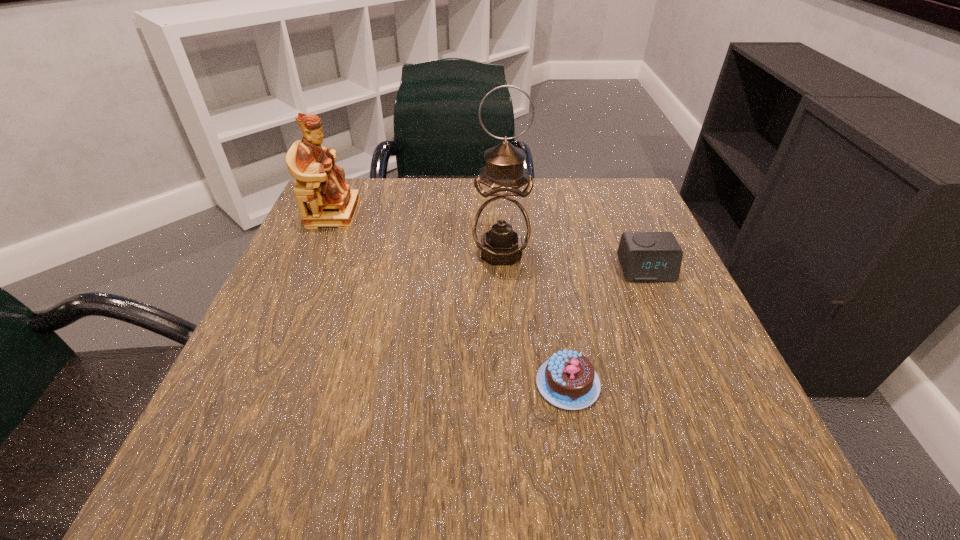
Locate an element on the screen. free space between the oil lamp and the third tallest object is located at coordinates (573, 261).

The width and height of the screenshot is (960, 540). I want to click on object that ranks as the closest to the oil lamp, so click(x=644, y=256).

Select which object appears as the closest to the rightmost object. Please provide its 2D coordinates. Your answer should be formatted as a tuple, i.e. [(x, y)], where the tuple contains the x and y coordinates of a point satisfying the conditions above.

[(501, 229)]

Where is `free space in the image that satisfies the following two spatial constraints: 1. on the front-facing side of the leftmost object; 2. on the back side of the oil lamp`? The width and height of the screenshot is (960, 540). free space in the image that satisfies the following two spatial constraints: 1. on the front-facing side of the leftmost object; 2. on the back side of the oil lamp is located at coordinates (317, 252).

You are a GUI agent. You are given a task and a screenshot of the screen. Output one action in this format:
    pyautogui.click(x=<x>, y=<y>)
    Task: Click on the vacant region that satisfies the following two spatial constraints: 1. on the front-facing side of the leftmost object; 2. on the back side of the nearest object
    
    Given the screenshot: What is the action you would take?
    pyautogui.click(x=258, y=383)

Where is `vacant area in the image that satisfies the following two spatial constraints: 1. on the front-facing side of the farthest object; 2. on the left side of the chocolate cake`? The width and height of the screenshot is (960, 540). vacant area in the image that satisfies the following two spatial constraints: 1. on the front-facing side of the farthest object; 2. on the left side of the chocolate cake is located at coordinates (258, 383).

This screenshot has width=960, height=540. In order to click on vacant space that satisfies the following two spatial constraints: 1. on the front-facing side of the chocolate cake; 2. on the left side of the leftmost object in this screenshot , I will do `click(258, 383)`.

At what (x,y) coordinates should I click in order to perform the action: click on vacant region that satisfies the following two spatial constraints: 1. on the front-facing side of the figurine; 2. on the back side of the tallest object. Please return your answer as a coordinate pair (x, y). The width and height of the screenshot is (960, 540). Looking at the image, I should click on (317, 252).

Locate an element on the screen. vacant space that satisfies the following two spatial constraints: 1. on the front side of the tallest object; 2. on the left side of the nearest object is located at coordinates (509, 383).

What are the coordinates of `vacant space that satisfies the following two spatial constraints: 1. on the front-facing side of the figurine; 2. on the back side of the oil lamp` in the screenshot? It's located at (317, 252).